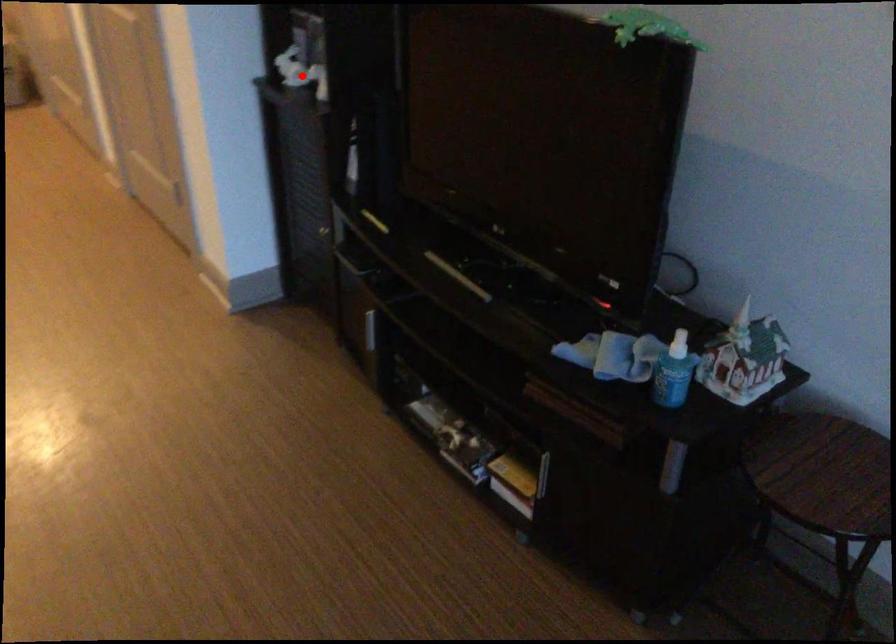
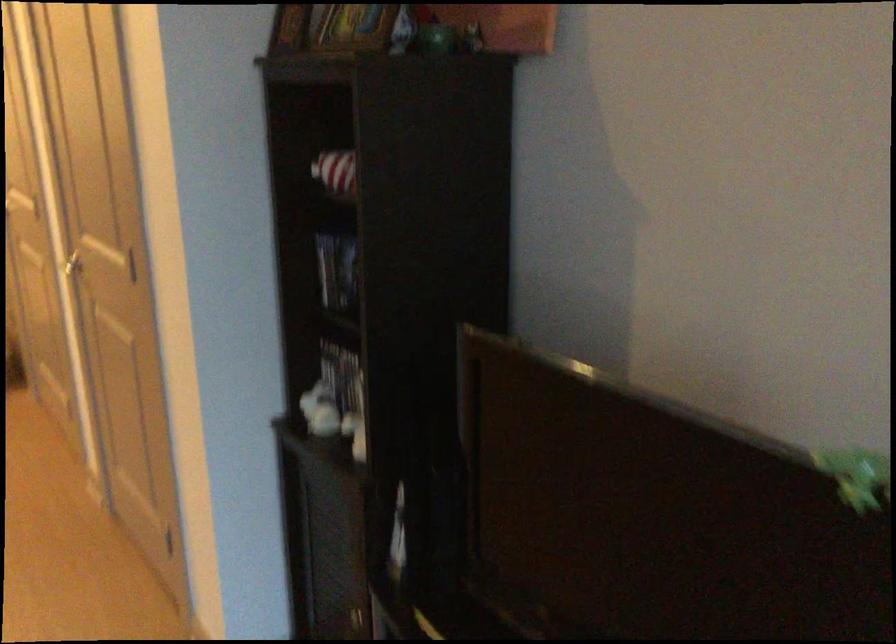
Find the pixel in the second image that matches the highlighted location in the first image.

(332, 418)